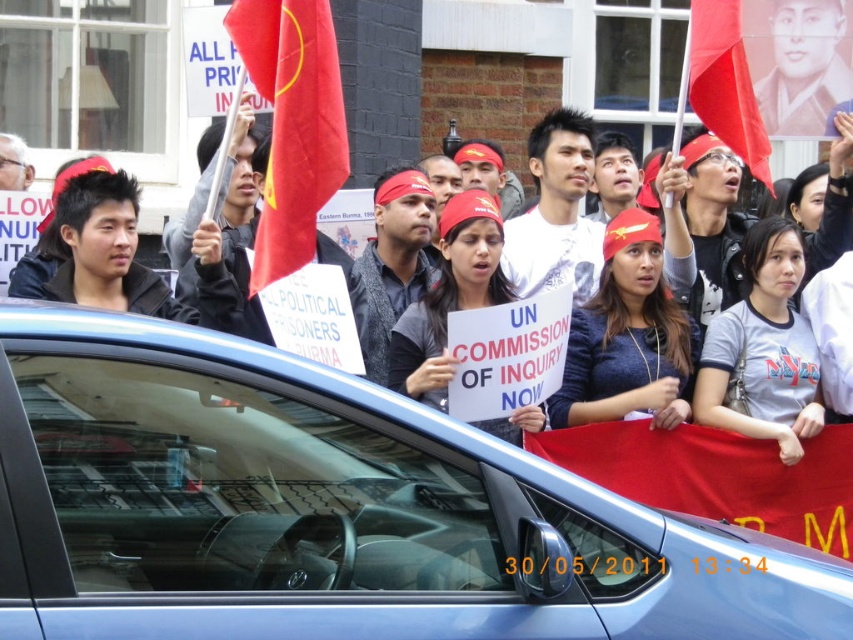
Can you confirm if blue metallic car at center is positioned above red fabric banner at center?

Correct, blue metallic car at center is located above red fabric banner at center.

Between blue metallic car at center and red fabric banner at center, which one is positioned higher?

blue metallic car at center is above.

Measure the distance between point (68,499) and camera.

Point (68,499) is 7.23 meters away from camera.

At what (x,y) coordinates should I click in order to perform the action: click on blue metallic car at center. Please return your answer as a coordinate pair (x, y). The image size is (853, 640). Looking at the image, I should click on point(331,509).

Is blue metallic car at center to the right of red fabric flag at center from the viewer's perspective?

Indeed, blue metallic car at center is positioned on the right side of red fabric flag at center.

Which of these two, blue metallic car at center or red fabric flag at center, stands taller?

red fabric flag at center is taller.

This screenshot has width=853, height=640. What do you see at coordinates (331, 509) in the screenshot?
I see `blue metallic car at center` at bounding box center [331, 509].

The image size is (853, 640). In order to click on blue metallic car at center in this screenshot , I will do [331, 509].

Can you confirm if matte red flag at upper right is positioned to the right of matte red bandana at center?

Correct, you'll find matte red flag at upper right to the right of matte red bandana at center.

Is matte red flag at upper right smaller than matte red bandana at center?

Yes, matte red flag at upper right is smaller than matte red bandana at center.

Is point (701, 16) positioned in front of point (677, 257)?

That is True.

Identify the location of matte red flag at upper right. [x=724, y=83].